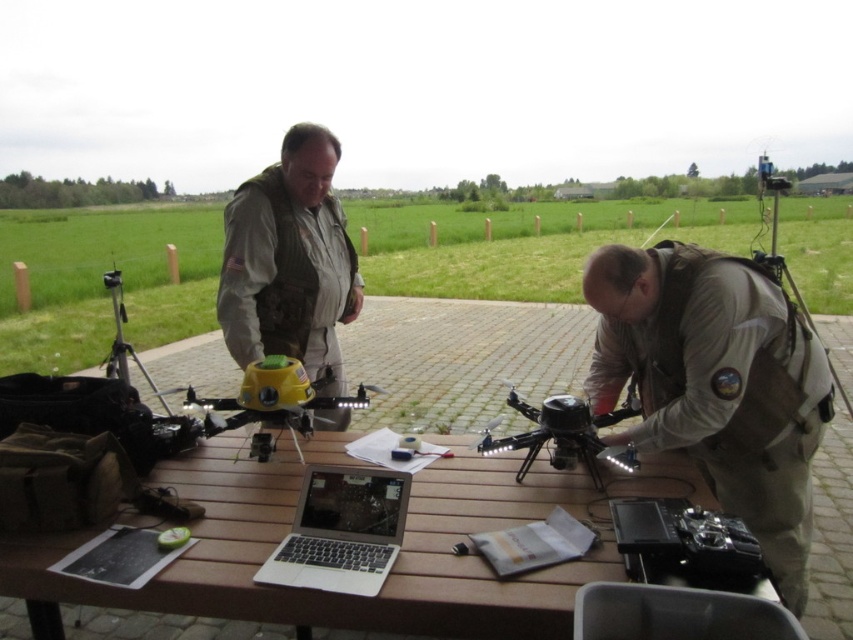
You are standing at the picnic table and want to place a marker between the two points, point (258, 353) and point (337, 548). Which point should you place the marker closer to so it is in front of both points?

You should place the marker closer to point (337, 548) because point (258, 353) is behind point (337, 548), so placing it near the front point ensures it is in front of both.

You are a technician trying to access the black matte drone at center. There is a silver metallic laptop at center in the way. Can you reach the drone without moving the laptop?

The silver metallic laptop at center is in front of the black matte drone at center, so you cannot reach the drone without moving the laptop.

You are a technician who needs to access the black matte drone at center for maintenance. The silver metallic laptop at center contains its control software. Can you reach the laptop without moving the drone?

The silver metallic laptop at center is located below the black matte drone at center, so yes, you can access the laptop without moving the drone.